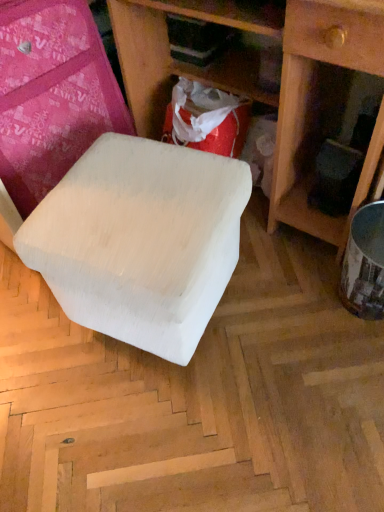
Locate an element on the screen. free location to the right of white matte stool at center is located at coordinates (286, 332).